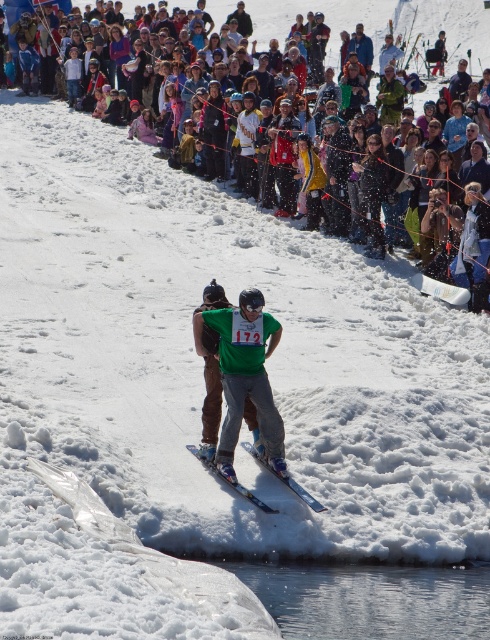
What are the coordinates of the green fabric snowboarder at center in the image?

The green fabric snowboarder at center is located at coordinates point [245,376].

You are a drone operator trying to capture aerial footage of the shiny blue skis at center and the multicolored fabric crowd at upper center. Which object should you focus on first to ensure you can capture both in the same frame?

You should focus on the multicolored fabric crowd at upper center first because it is closer to the viewer than the shiny blue skis at center, allowing you to adjust the camera angle to include both in the frame.